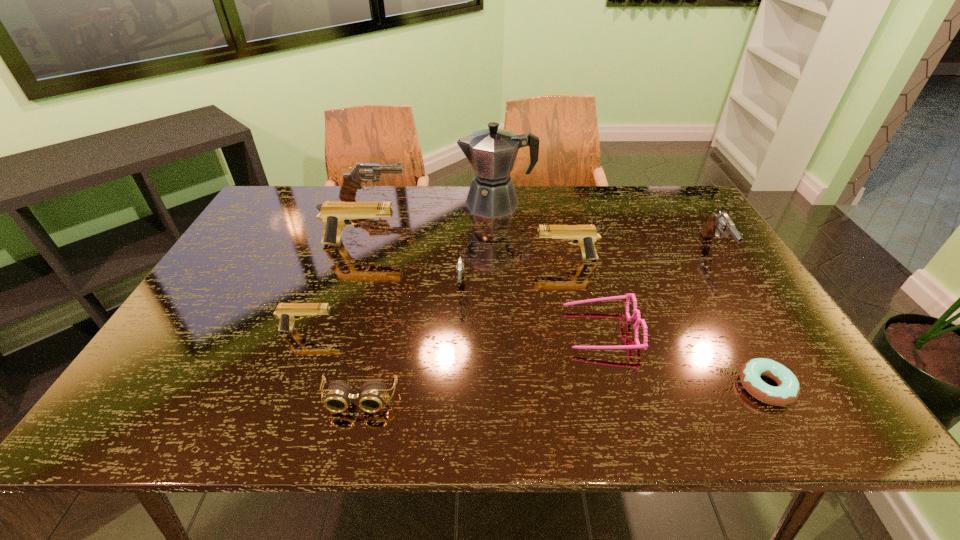
Where is `free spot at the left edge of the desktop`? free spot at the left edge of the desktop is located at coordinates (258, 232).

Find the location of a particular element. This screenshot has height=540, width=960. free space at the right edge of the desktop is located at coordinates (666, 238).

This screenshot has width=960, height=540. In order to click on vacant area at the far left corner of the desktop in this screenshot , I will do `click(302, 214)`.

Locate an element on the screen. unoccupied area between the second nearest gray pistol and the nearest tan pistol is located at coordinates (512, 290).

This screenshot has height=540, width=960. Identify the location of free space between the second nearest tan pistol and the rightmost pistol. (640, 254).

This screenshot has width=960, height=540. Find the location of `vacant area between the farthest gray pistol and the rightmost tan pistol`. vacant area between the farthest gray pistol and the rightmost tan pistol is located at coordinates (469, 230).

You are a GUI agent. You are given a task and a screenshot of the screen. Output one action in this format:
    pyautogui.click(x=<x>, y=<y>)
    Task: Click on the unoccupied position between the goggles and the biggest tan pistol
    The height and width of the screenshot is (540, 960).
    Given the screenshot: What is the action you would take?
    pyautogui.click(x=360, y=322)

Identify the location of free point between the nearest pistol and the rightmost gray pistol. (512, 290).

This screenshot has width=960, height=540. I want to click on empty location between the rightmost pistol and the shortest object, so click(740, 318).

Locate an element on the screen. free space between the second farthest tan pistol and the biggest gray pistol is located at coordinates (469, 230).